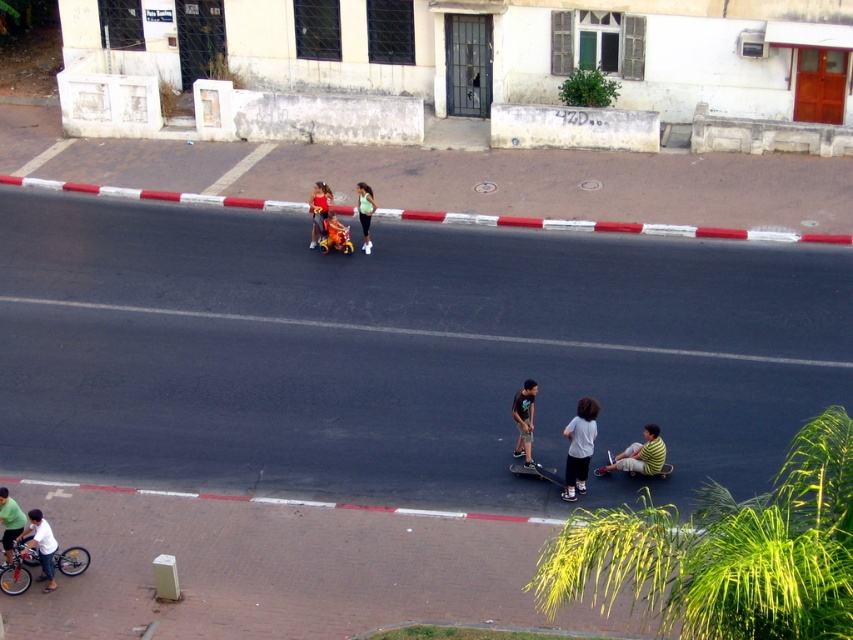
Question: Does brushed metal bicycle at lower left lie in front of white matte bicycle at lower left?

Choices:
 (A) no
 (B) yes

Answer: (A)

Question: Estimate the real-world distances between objects in this image. Which object is farther from the yellow striped skateboard at lower right?

Choices:
 (A) white matte bicycle at lower left
 (B) matte red scooter at center
 (C) green jersey at lower left
 (D) brushed metal bicycle at lower left

Answer: (B)

Question: Which point appears farthest from the camera in this image?

Choices:
 (A) (370, 202)
 (B) (67, 573)
 (C) (322, 209)
 (D) (665, 476)

Answer: (C)

Question: Estimate the real-world distances between objects in this image. Which object is farther from the matte red scooter at center?

Choices:
 (A) metallic silver baby carriage at center
 (B) brushed metal bicycle at lower left
 (C) dark gray skateboarding at center

Answer: (B)

Question: Can you confirm if green matte shirt at center is wider than yellow striped skateboard at lower right?

Choices:
 (A) yes
 (B) no

Answer: (B)

Question: Is brushed metal bicycle at lower left closer to the viewer compared to yellow striped skateboard at lower right?

Choices:
 (A) no
 (B) yes

Answer: (B)